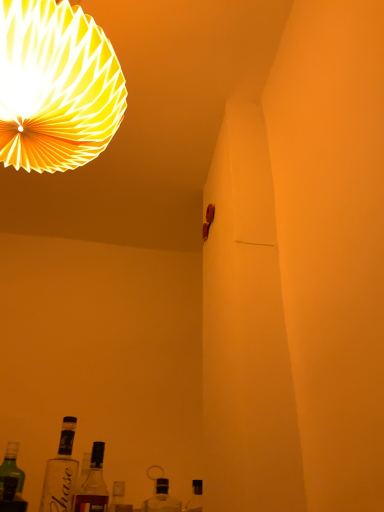
Question: In the image, is clear glass bottle at lower center, placed as the 3th bottle when sorted from left to right, positioned in front of or behind translucent glass bottle at lower center, which is the second bottle in right-to-left order?

Choices:
 (A) behind
 (B) front

Answer: (B)

Question: From a real-world perspective, relative to translucent glass bottle at lower center, which ranks as the second bottle in left-to-right order, is clear glass bottle at lower center, placed as the 1th bottle when sorted from right to left, vertically above or below?

Choices:
 (A) below
 (B) above

Answer: (A)

Question: Considering the real-world distances, which object is closest to the clear glass bottle at lower center, placed as the 3th bottle when sorted from left to right?

Choices:
 (A) translucent glass bottle at lower center, which is the second bottle in right-to-left order
 (B) white paper lampshade at upper left
 (C) clear glass bottle at lower left, the 1th bottle positioned from the left

Answer: (A)

Question: Which object is the closest to the clear glass bottle at lower center, placed as the 1th bottle when sorted from right to left?

Choices:
 (A) translucent glass bottle at lower center, which ranks as the second bottle in left-to-right order
 (B) white paper lampshade at upper left
 (C) clear glass bottle at lower left, the 3th bottle viewed from the right

Answer: (A)